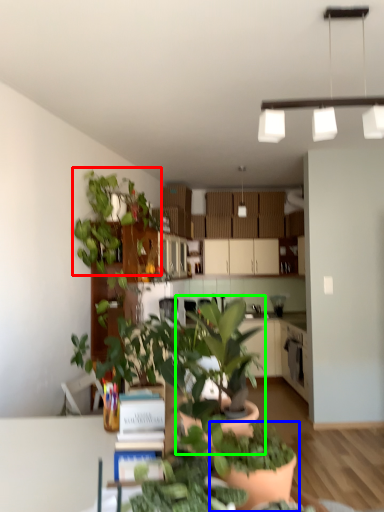
Question: Based on their relative distances, which object is nearer to houseplant (highlighted by a red box)? Choose from houseplant (highlighted by a blue box) and houseplant (highlighted by a green box).

Choices:
 (A) houseplant
 (B) houseplant

Answer: (B)